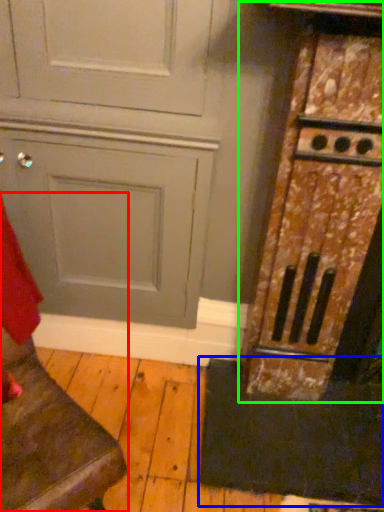
Question: Considering the real-world distances, which object is closest to furniture (highlighted by a red box)? doormat (highlighted by a blue box) or cabinetry (highlighted by a green box).

Choices:
 (A) doormat
 (B) cabinetry

Answer: (A)